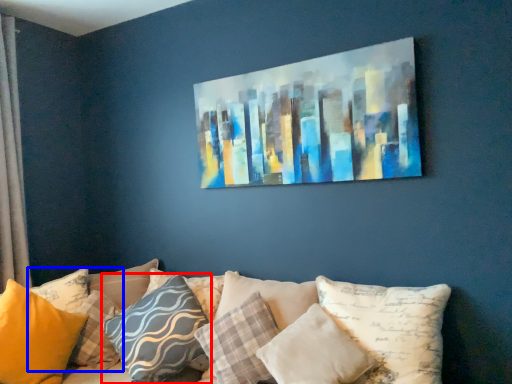
Question: Which object appears closest to the camera in this image, pillow (highlighted by a red box) or pillow (highlighted by a blue box)?

Choices:
 (A) pillow
 (B) pillow

Answer: (B)